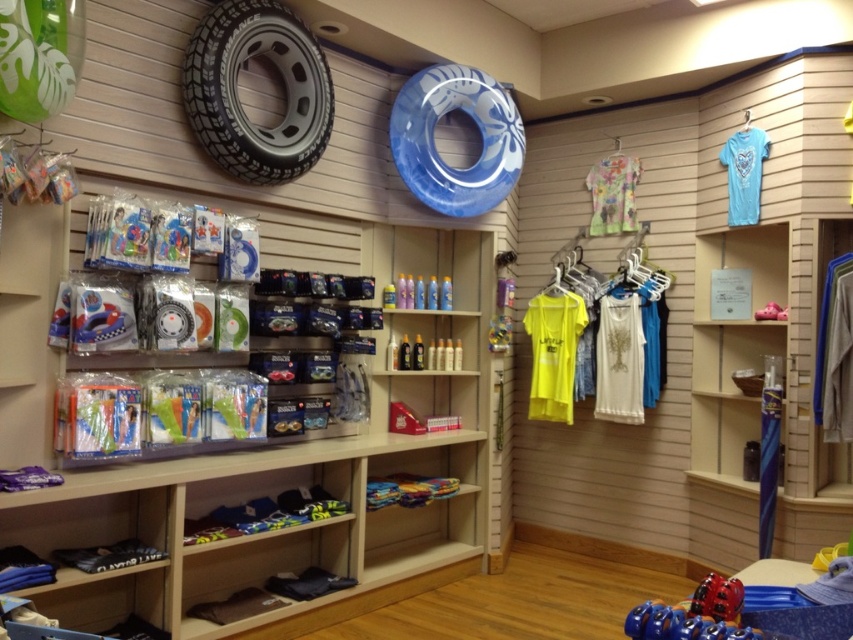
You are a customer in the store and want to place a small gift card on the counter between the black rubber tire at upper center and the light blue jersey at upper right. Is there enough space between them to place the gift card?

The black rubber tire at upper center is positioned on the left side of light blue jersey at upper right, so there is space between them to place the gift card.